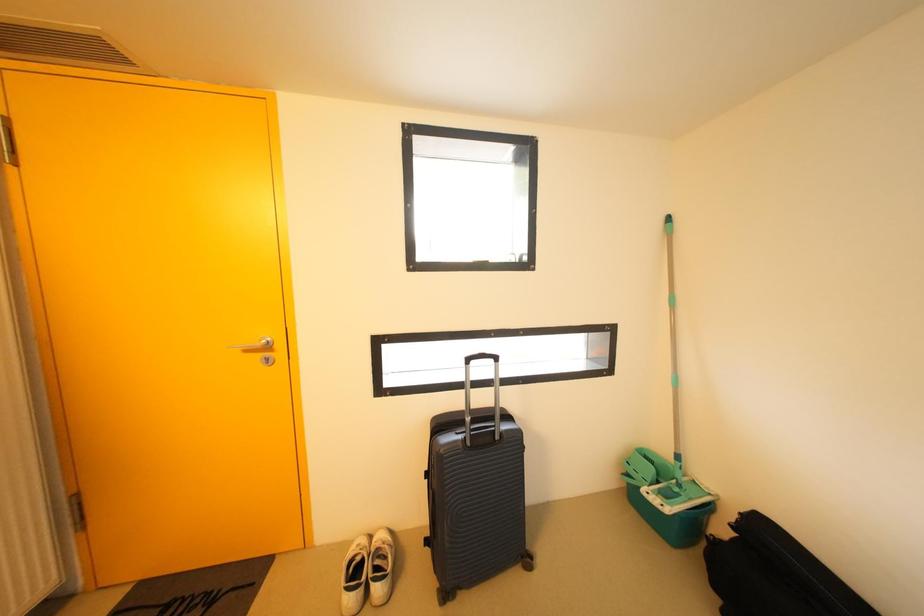
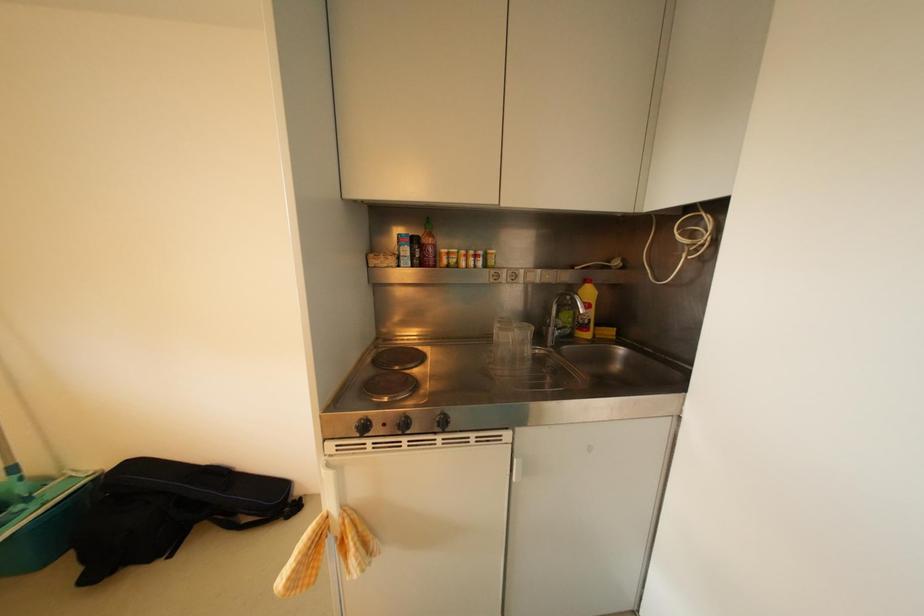
Question: The camera is either moving clockwise (left) or counter-clockwise (right) around the object. The first image is from the beginning of the video and the second image is from the end. Is the camera moving left or right when shooting the video?

Choices:
 (A) Left
 (B) Right

Answer: (A)